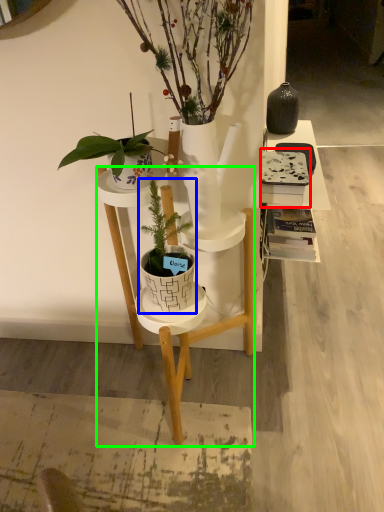
Question: Which object is the closest to the book (highlighted by a red box)? Choose among these: houseplant (highlighted by a blue box) or desk (highlighted by a green box).

Choices:
 (A) houseplant
 (B) desk

Answer: (B)